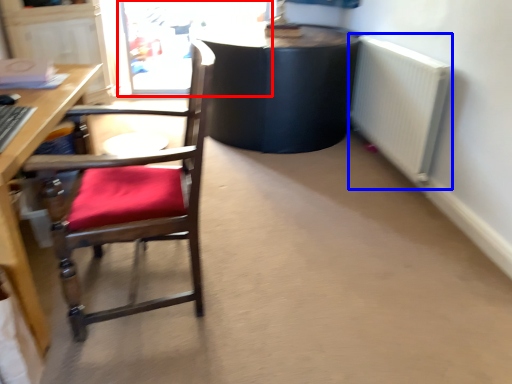
Question: Which point is closer to the camera, screen door (highlighted by a red box) or radiator (highlighted by a blue box)?

Choices:
 (A) screen door
 (B) radiator

Answer: (B)